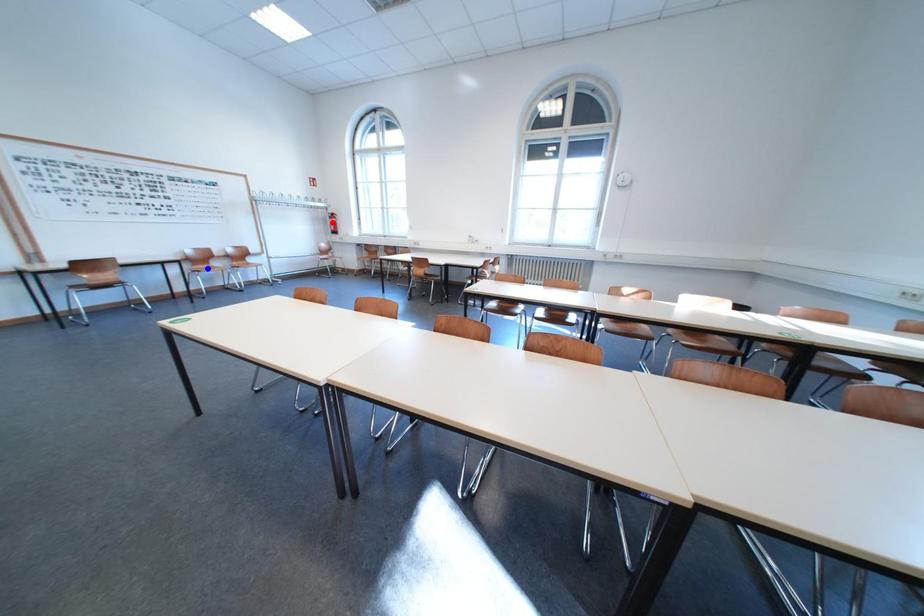
Question: Two points are marked on the image. Which point is closer to the camera?

Choices:
 (A) Blue point is closer.
 (B) Red point is closer.

Answer: (A)